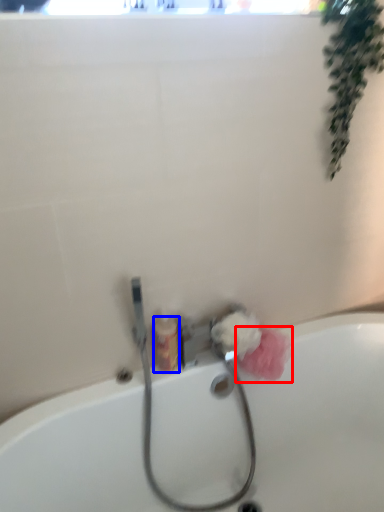
Question: Which object appears farthest to the camera in this image, flower (highlighted by a red box) or toiletry (highlighted by a blue box)?

Choices:
 (A) flower
 (B) toiletry

Answer: (A)